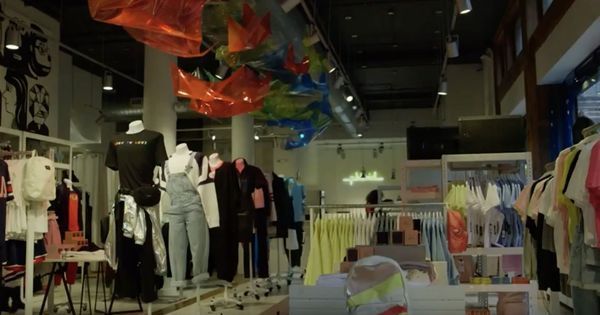
Find the location of `window`. window is located at coordinates (587, 112).